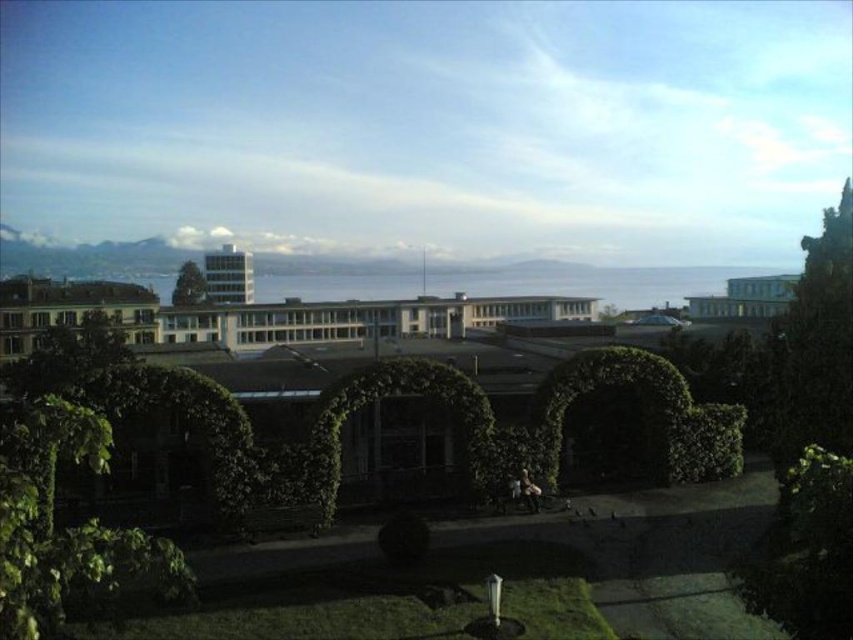
Is green leafy tree at right to the right of green leafy tree at upper center from the viewer's perspective?

Yes, green leafy tree at right is to the right of green leafy tree at upper center.

Is point (846, 282) behind point (200, 292)?

That is False.

What do you see at coordinates (814, 348) in the screenshot?
I see `green leafy tree at right` at bounding box center [814, 348].

The image size is (853, 640). I want to click on green leafy tree at right, so click(814, 348).